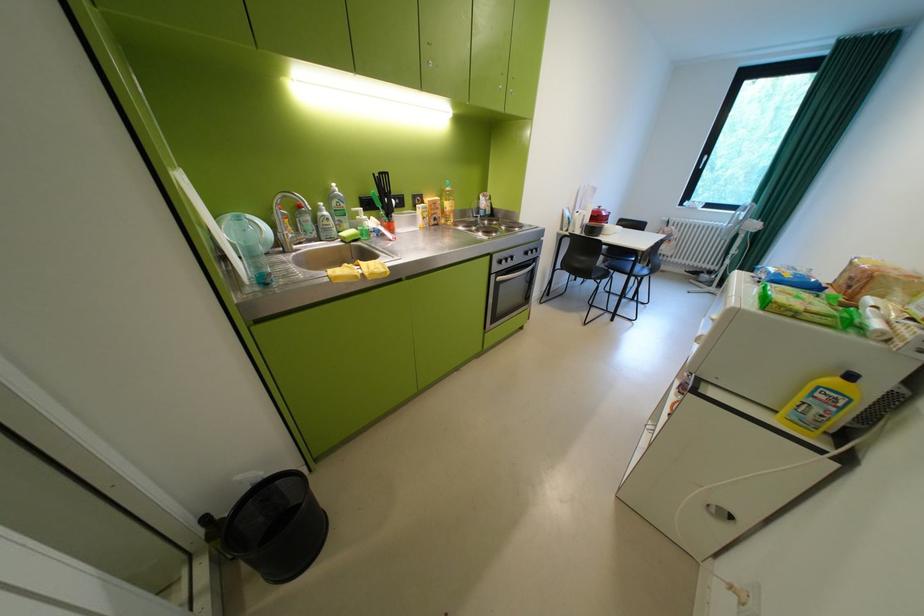
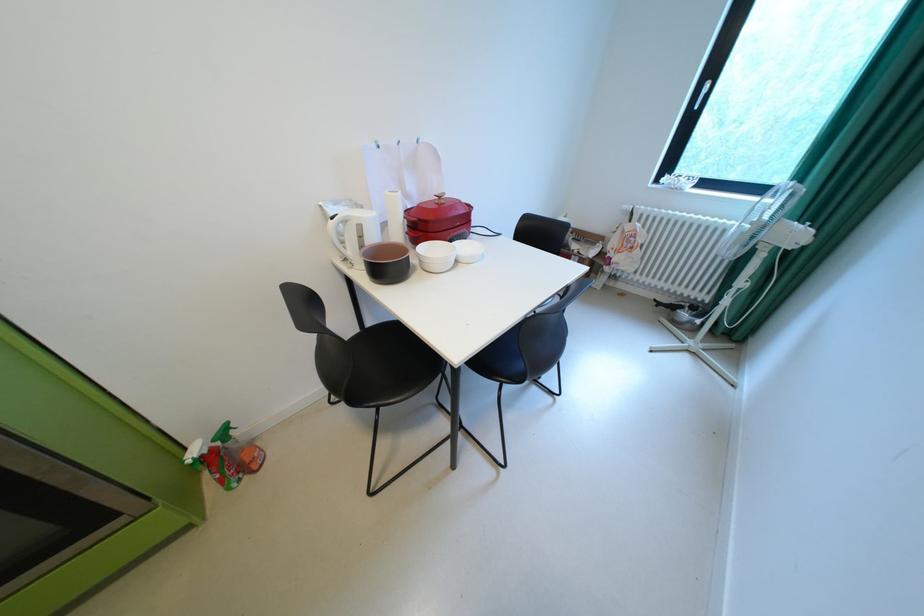
In a continuous first-person perspective shot, in which direction is the camera moving?

The movement direction of the cameraman is right, forward.